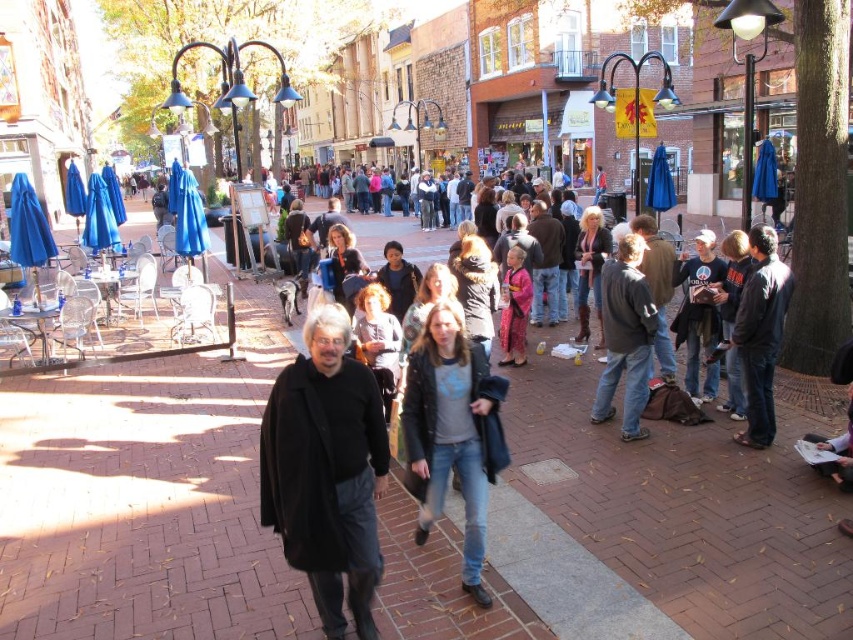
Question: Which point is closer to the camera taking this photo?

Choices:
 (A) (x=339, y=364)
 (B) (x=440, y=476)

Answer: (A)

Question: Is black matte coat at center wider than black leather jacket at right?

Choices:
 (A) no
 (B) yes

Answer: (B)

Question: In this image, where is brick pavement at center located relative to dark blue jeans at center?

Choices:
 (A) above
 (B) below

Answer: (A)

Question: Does black leather jacket at right come behind dark blue jeans at center?

Choices:
 (A) no
 (B) yes

Answer: (A)

Question: Which is nearer to the dark blue jeans at center?

Choices:
 (A) black leather jacket at right
 (B) pink fabric dress at center
 (C) denim jacket at center

Answer: (A)

Question: Which object is positioned closest to the pink fabric dress at center?

Choices:
 (A) dark blue jeans at center
 (B) brick pavement at center

Answer: (A)